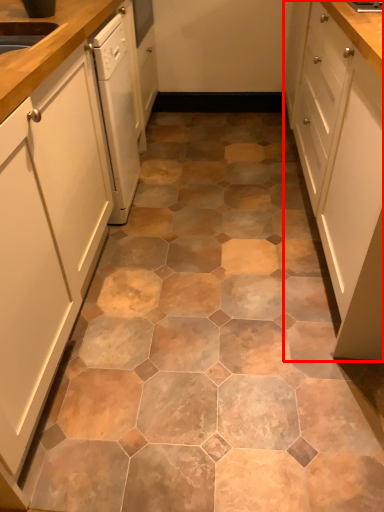
Question: From the image, what is the correct spatial relationship of cabinetry (annotated by the red box) in relation to cabinetry?

Choices:
 (A) right
 (B) left

Answer: (A)